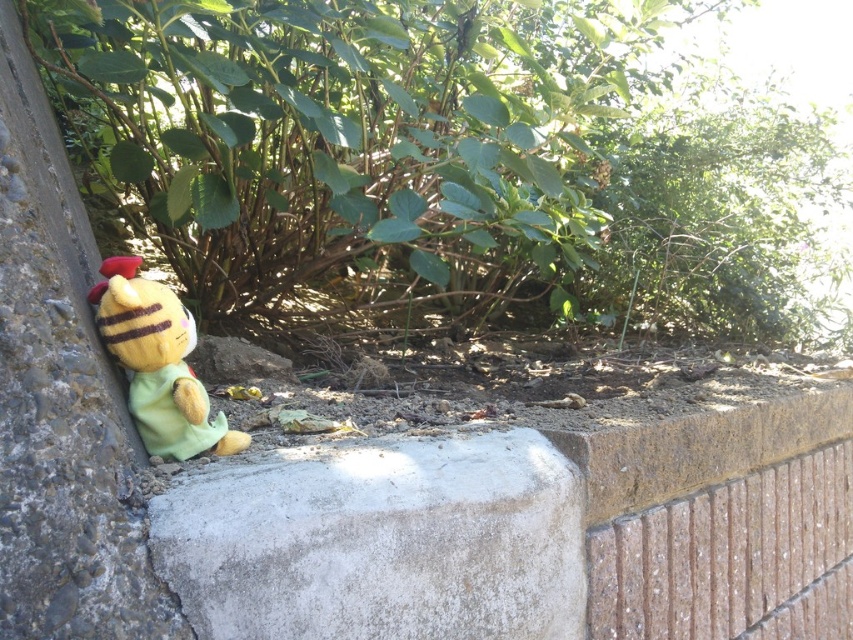
Is green leafy bush at center shorter than yellow plush toy at left?

No, green leafy bush at center is not shorter than yellow plush toy at left.

Is point (323, 252) farther from viewer compared to point (107, 305)?

Yes.

Which is behind, point (357, 28) or point (189, 413)?

The point (357, 28) is behind.

This screenshot has height=640, width=853. What are the coordinates of `green leafy bush at center` in the screenshot? It's located at (357, 138).

Who is taller, green leafy bush at center or gray concrete block at center?

green leafy bush at center is taller.

Measure the distance between green leafy bush at center and gray concrete block at center.

green leafy bush at center and gray concrete block at center are 1.15 meters apart.

You are a GUI agent. You are given a task and a screenshot of the screen. Output one action in this format:
    pyautogui.click(x=<x>, y=<y>)
    Task: Click on the green leafy bush at center
    This screenshot has height=640, width=853.
    Given the screenshot: What is the action you would take?
    pyautogui.click(x=357, y=138)

Image resolution: width=853 pixels, height=640 pixels. What are the coordinates of `green leafy bush at center` in the screenshot? It's located at (357, 138).

Is gray concrete block at center further to camera compared to yellow plush toy at left?

No, it is not.

Is gray concrete block at center to the left of yellow plush toy at left from the viewer's perspective?

No, gray concrete block at center is not to the left of yellow plush toy at left.

Locate an element on the screen. The image size is (853, 640). gray concrete block at center is located at coordinates (381, 544).

The height and width of the screenshot is (640, 853). I want to click on gray concrete block at center, so click(381, 544).